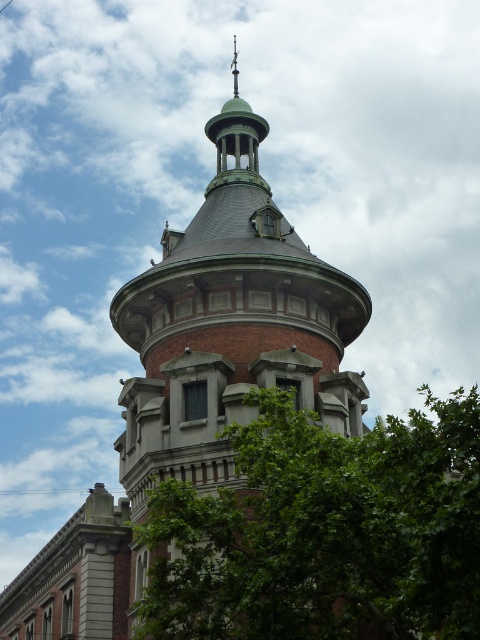
Question: Is green leafy tree at center to the left of red brick tower at center from the viewer's perspective?

Choices:
 (A) no
 (B) yes

Answer: (A)

Question: Which point is farther from the camera taking this photo?

Choices:
 (A) (264, 572)
 (B) (170, 371)

Answer: (B)

Question: Is green leafy tree at center below red brick tower at center?

Choices:
 (A) yes
 (B) no

Answer: (A)

Question: Can you confirm if green leafy tree at center is thinner than red brick tower at center?

Choices:
 (A) no
 (B) yes

Answer: (A)

Question: Which object is farther from the camera taking this photo?

Choices:
 (A) red brick tower at center
 (B) green leafy tree at center

Answer: (A)